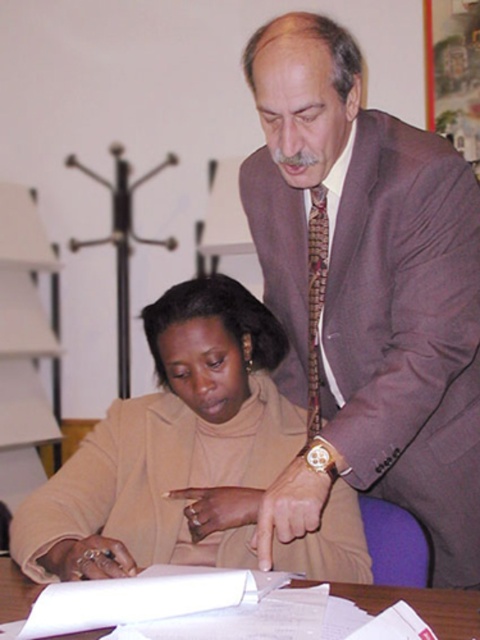
Question: Estimate the real-world distances between objects in this image. Which object is closer to the beige fabric jacket at lower left?

Choices:
 (A) white paper at center
 (B) brown suit at upper right

Answer: (B)

Question: Which of the following is the farthest from the observer?

Choices:
 (A) white paper at center
 (B) brown suit at upper right

Answer: (B)

Question: Does brown suit at upper right have a lesser width compared to white paper at center?

Choices:
 (A) no
 (B) yes

Answer: (A)

Question: Is brown suit at upper right above white paper at center?

Choices:
 (A) no
 (B) yes

Answer: (B)

Question: Is brown suit at upper right below beige fabric jacket at lower left?

Choices:
 (A) yes
 (B) no

Answer: (B)

Question: Considering the real-world distances, which object is farthest from the white paper at center?

Choices:
 (A) beige fabric jacket at lower left
 (B) brown suit at upper right

Answer: (B)